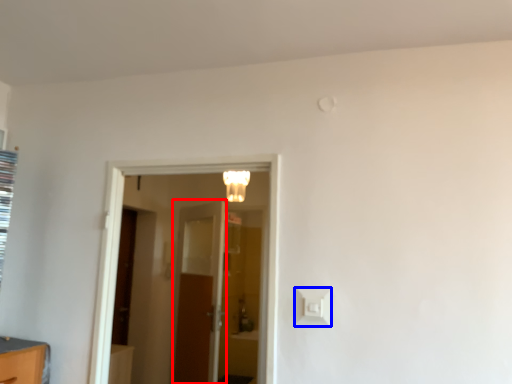
Question: Among these objects, which one is farthest to the camera, door (highlighted by a red box) or light switch (highlighted by a blue box)?

Choices:
 (A) door
 (B) light switch

Answer: (A)